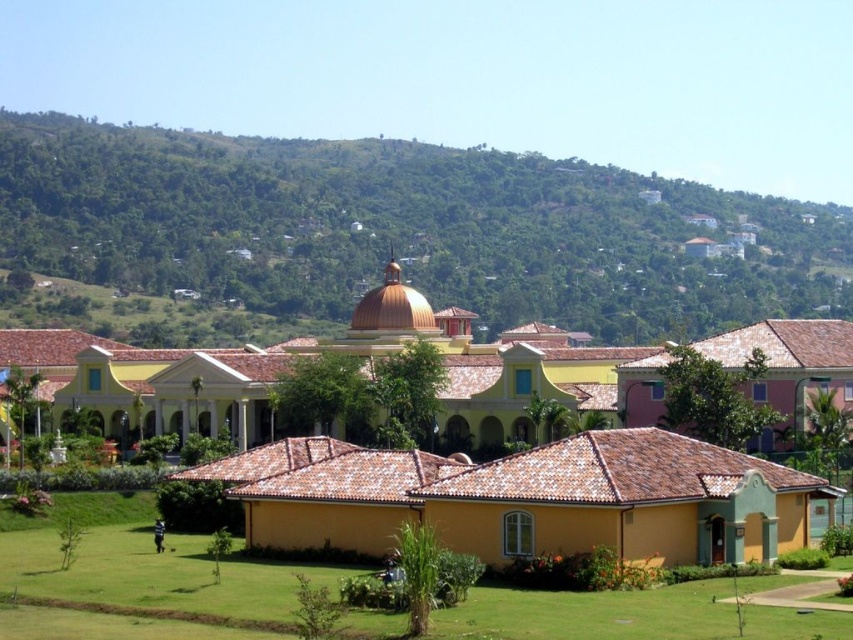
Can you confirm if green leafy hillside at upper center is positioned below green grass lawn at lower left?

No.

Measure the distance between point (x=339, y=298) and camera.

Point (x=339, y=298) is 907.69 feet from camera.

Does point (4, 156) lie in front of point (138, 532)?

No, (4, 156) is behind (138, 532).

Where is `green leafy hillside at upper center`? green leafy hillside at upper center is located at coordinates (407, 228).